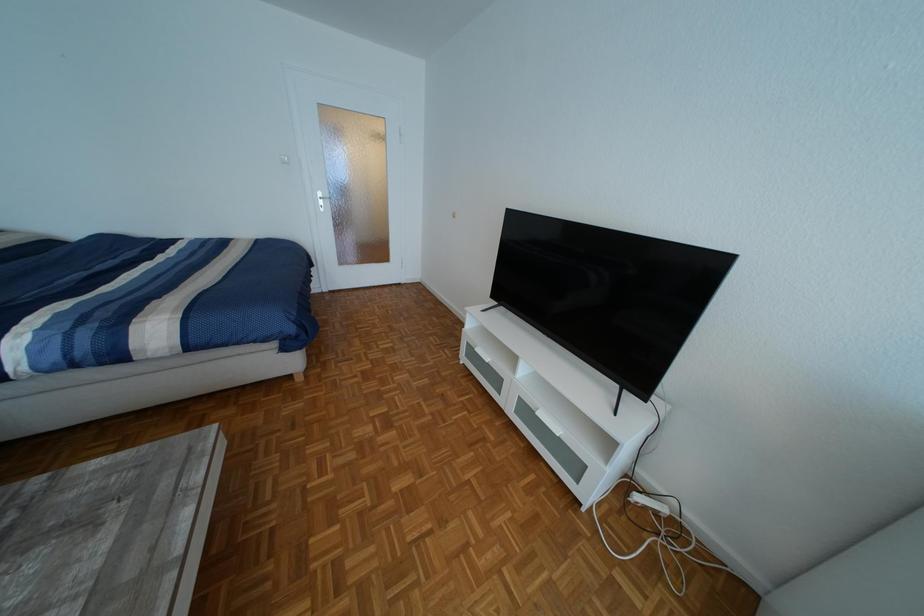
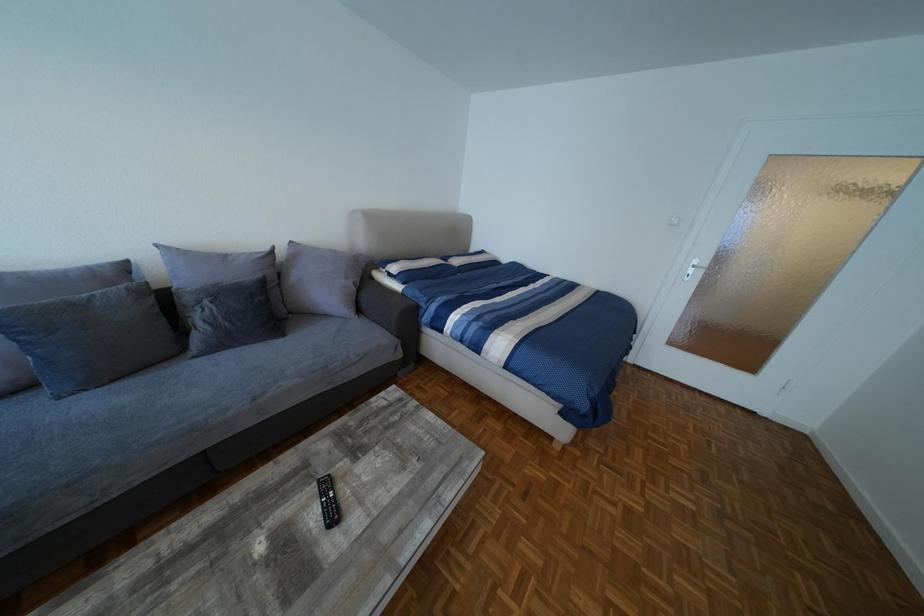
Question: Based on the continuous images, in which direction is the camera rotating? Reply with the corresponding letter.

Choices:
 (A) Left
 (B) Right
 (C) Up
 (D) Down

Answer: (A)